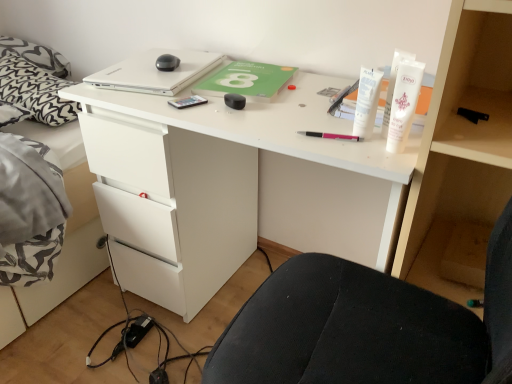
Where is `free area in between satin silver phone at center, which is the 4th stationery in front-to-back order, and white matte tube at upper right, arranged as the second toiletry when viewed from the left`? This screenshot has width=512, height=384. free area in between satin silver phone at center, which is the 4th stationery in front-to-back order, and white matte tube at upper right, arranged as the second toiletry when viewed from the left is located at coordinates (269, 124).